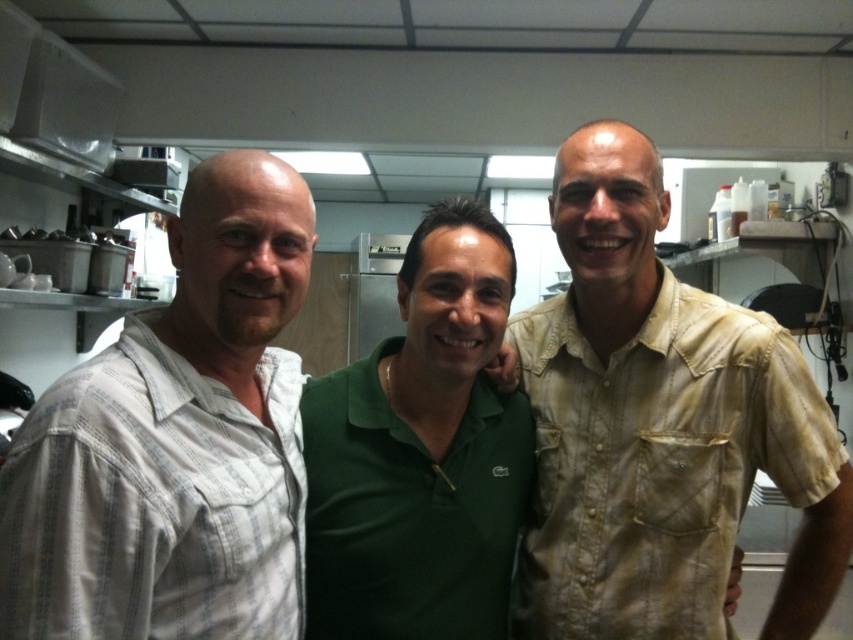
You are a chef in a commercial kitchen and need to quickly identify the size of the two staff members based on their shirts. Which staff member is wearing a larger shirt, the one in the light brown textured shirt at right or the green polo shirt at center?

The light brown textured shirt at right is bigger than the green polo shirt at center, so the staff member in the light brown textured shirt at right is wearing a larger shirt.

In the commercial kitchen scene, there are three people standing close together. The first person on the left wears a light colored long sleeved shirt with vertical stripes, the second in the center has a green polo shirt, and the third on the right is wearing a light beige button up shirt. A point at coordinates (659, 426) is marked in the image. Which person is closest to this point?

The point at (659, 426) indicates the light brown textured shirt at right, so the person on the right in the light beige button up shirt is closest to this point.